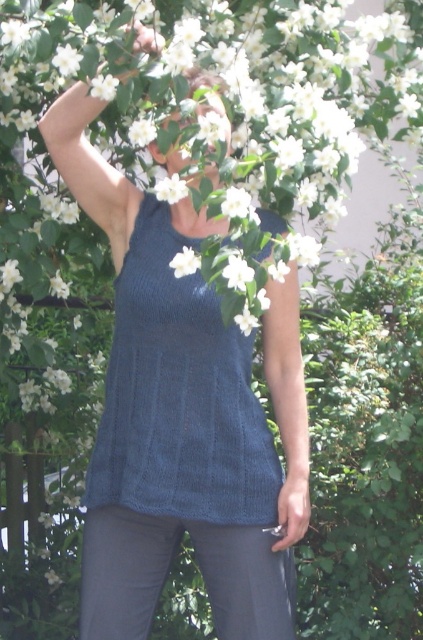
You are standing at the point marked as point (186,355) and want to walk to the nearest tree. The nearest tree is 2.22 meters away from you. Can you reach the tree within 3 steps if each step you take is 0.8 meters long?

The distance to the nearest tree is 2.22 meters. Each step covers 0.8 meters, so 3 steps would cover 2.4 meters. Since 2.4 meters is greater than 2.22 meters, you can reach the tree within 3 steps.